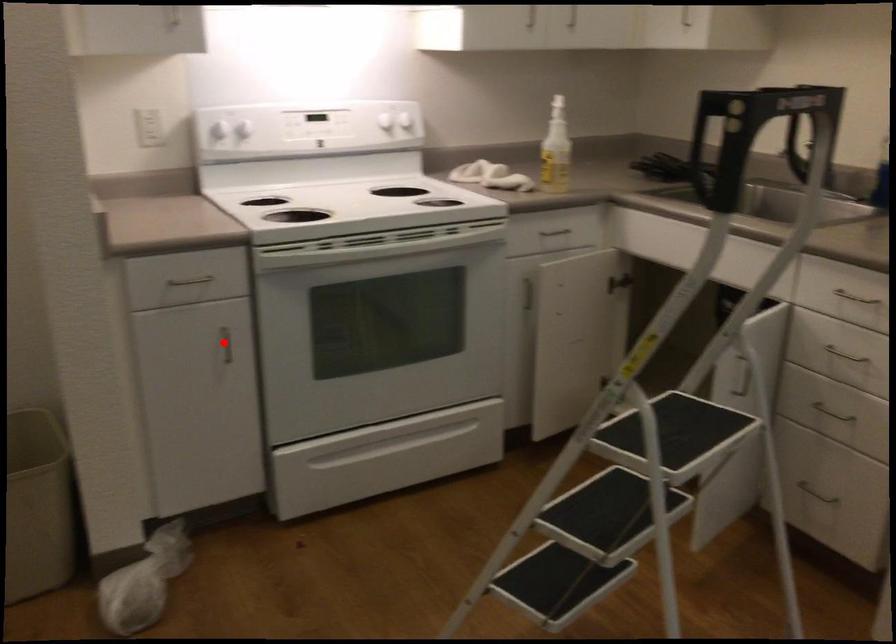
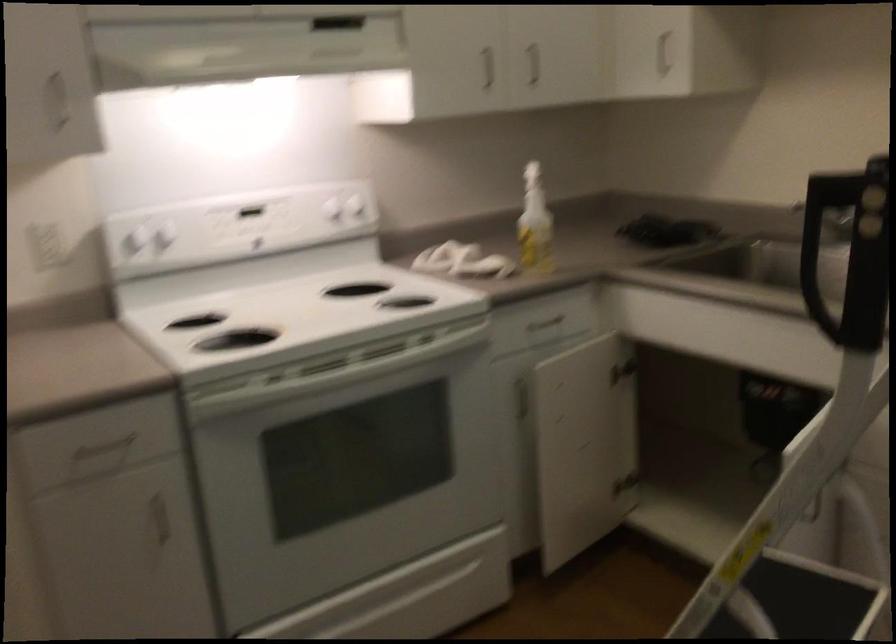
Locate, in the second image, the point that corresponds to the highlighted location in the first image.

(159, 514)